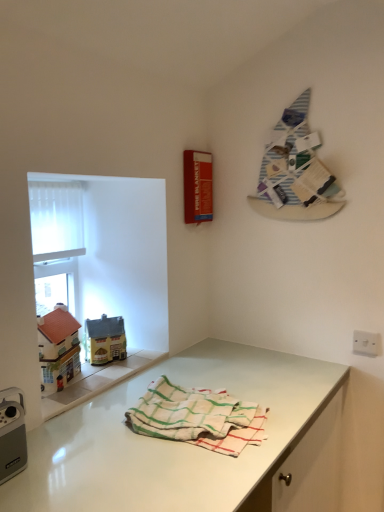
Where is `vacant space that's between matte plastic toy house at left, the 1th toy when ordered from left to right, and matte yellow house at left, which appears as the second toy when viewed from the front`? vacant space that's between matte plastic toy house at left, the 1th toy when ordered from left to right, and matte yellow house at left, which appears as the second toy when viewed from the front is located at coordinates (91, 374).